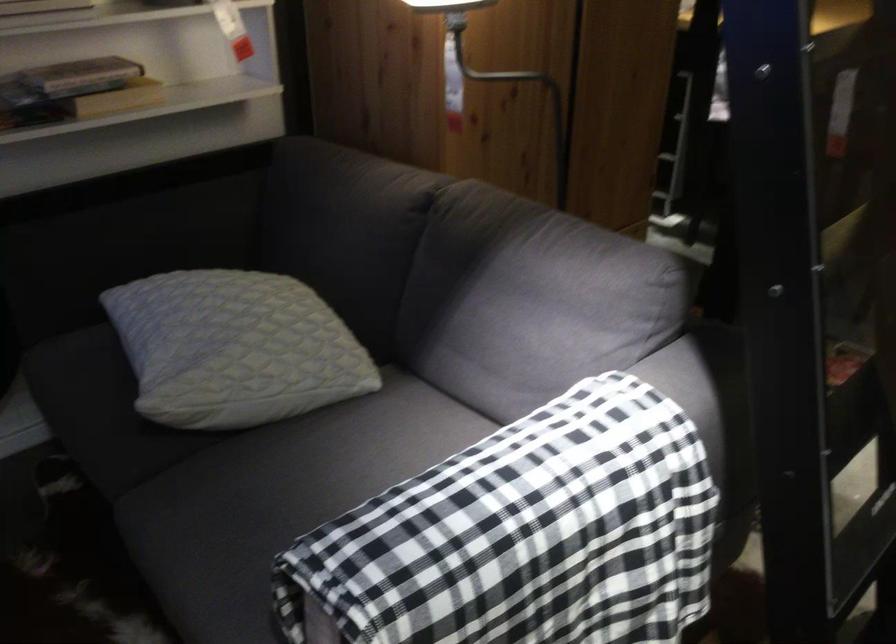
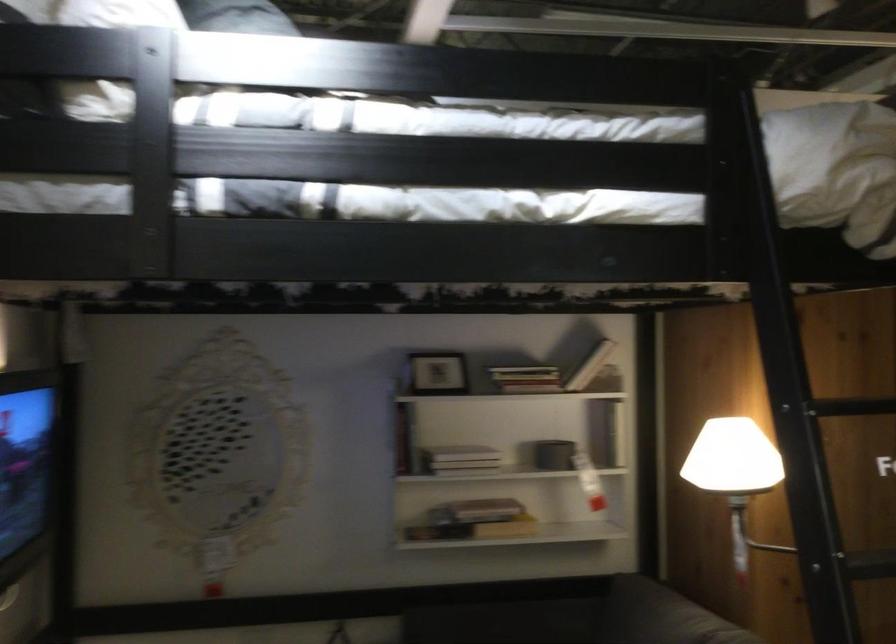
Question: I am providing you with two images of the same scene from different viewpoints. After the viewpoint changes to image2, which objects are now occluded?

Choices:
 (A) black lamp arm
 (B) book
 (C) blue ball
 (D) small picture frame

Answer: (A)